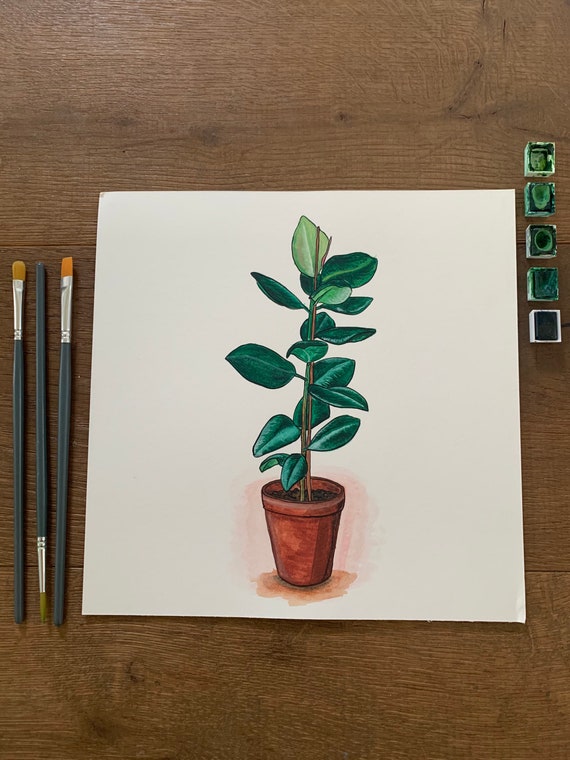
You are a GUI agent. You are given a task and a screenshot of the screen. Output one action in this format:
    pyautogui.click(x=<x>, y=<y>)
    Task: Click on the plant
    The height and width of the screenshot is (760, 570).
    Given the screenshot: What is the action you would take?
    pyautogui.click(x=312, y=361)